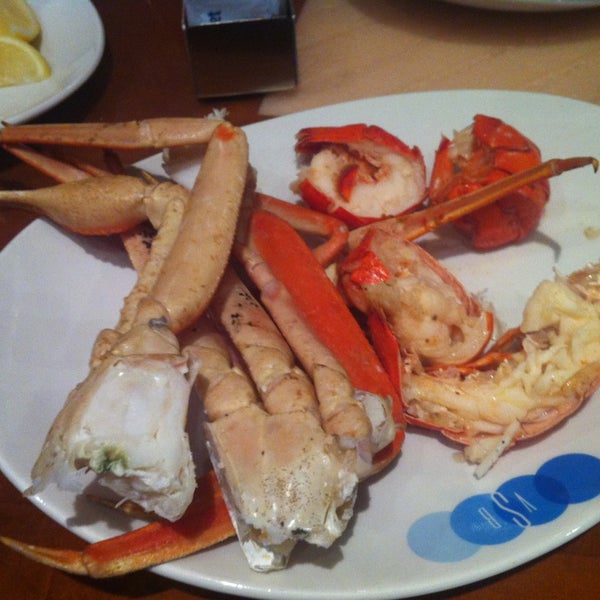
Where is `stainless steel condiments container`? stainless steel condiments container is located at coordinates (257, 63).